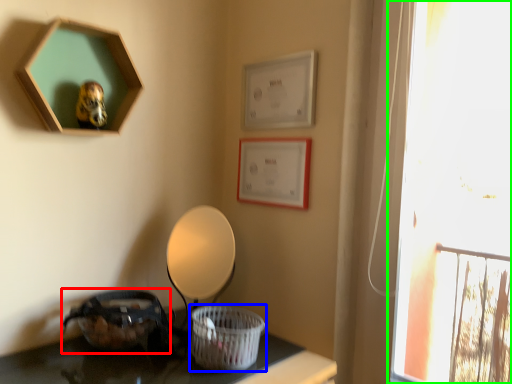
Question: Which object is positioned closest to basket (highlighted by a red box)? Select from basket (highlighted by a blue box) and window (highlighted by a green box).

Choices:
 (A) basket
 (B) window

Answer: (A)